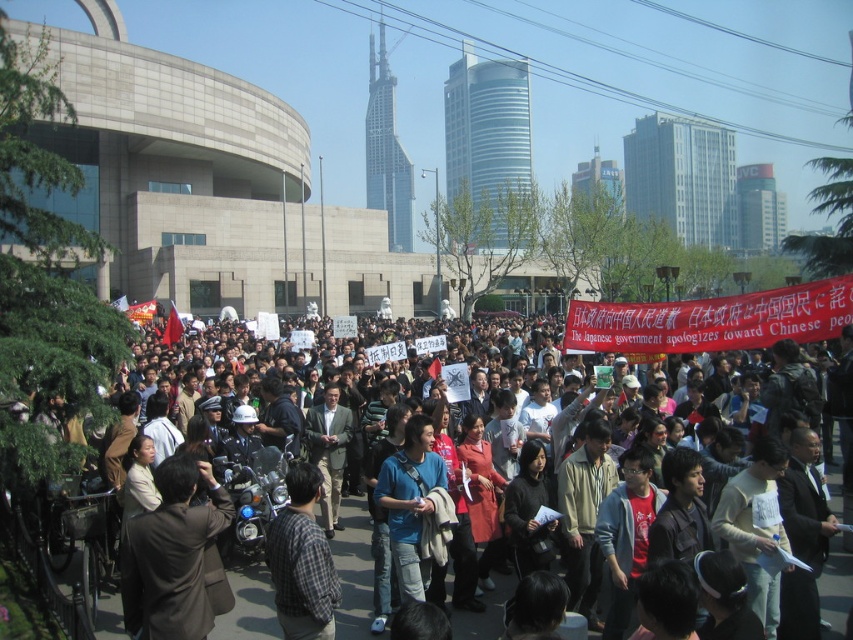
You are standing at the center of the square and want to find the brown fabric coat at lower left. Which direction should you look to locate it?

The brown fabric coat at lower left is located at the lower left direction from your current position at the center of the square.

Based on the photo, please provide the exact 2D coordinates of the brown fabric coat at lower left in the image. The coordinates should be given as a pair of numbers within parentheses, like this example format. Please do not add any extra text or explanation beyond the coordinate pair.

The exact 2D coordinates of the brown fabric coat at lower left are at point (172, 554).

You are a photographer trying to capture a clear shot of the plaid shirt at center. However, the brown fabric coat at lower left is blocking your view. Based on their sizes, which object do you think you can move to get a better angle?

The brown fabric coat at lower left is larger in size than plaid shirt at center, so it would be easier to move the plaid shirt at center to get a better angle since it is smaller and less obstructive.